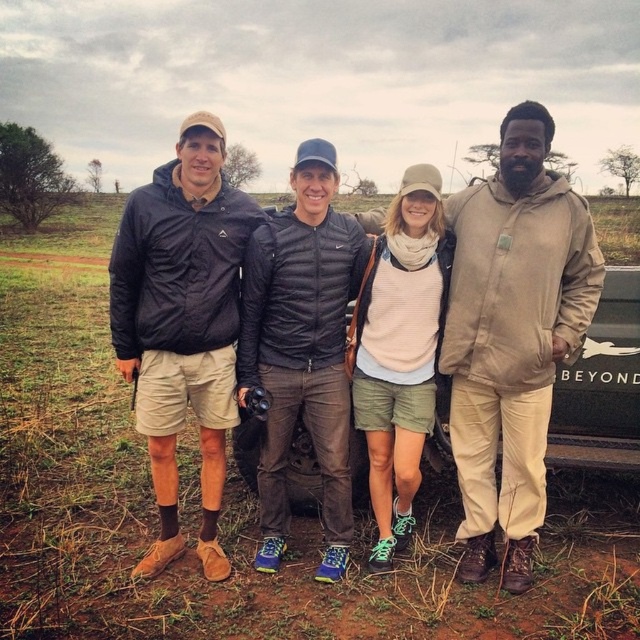
You are standing at the origin point of the coordinate system. You want to move towards the black quilted jacket at center. What direction should you move in?

The black quilted jacket at center is located at coordinate point (x=301, y=348), so you should move towards the northeast direction to reach it.

You are standing at point (442,284) and want to walk to point (298,246). Which direction should you move?

You should move forward because point (298,246) is in front of point (442,284).

You are a photographer trying to capture a photo of the two jackets in the scene. The matte black jacket at center and the black quilted jacket at center. Which jacket is positioned higher in the image?

The matte black jacket at center is located above the black quilted jacket at center, so it is positioned higher in the image.